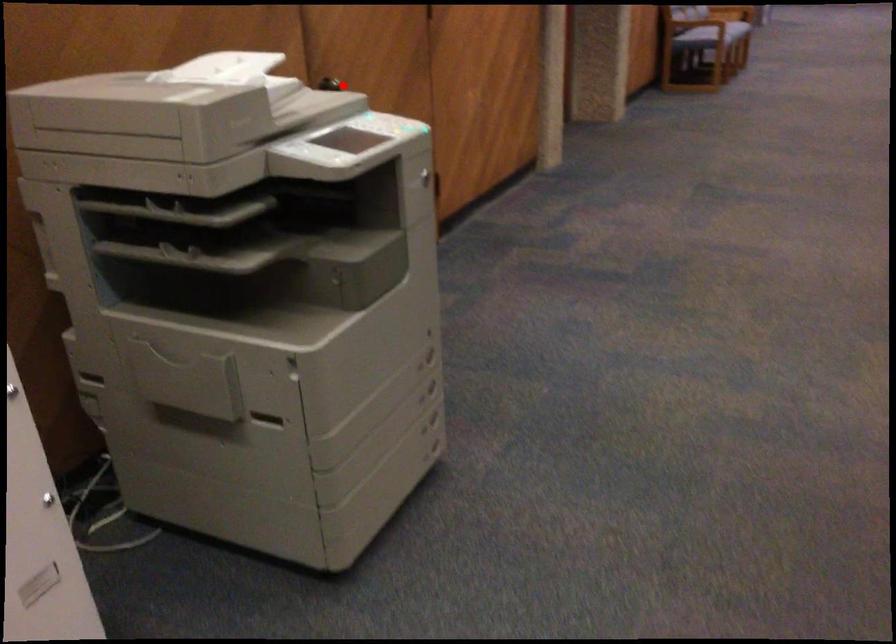
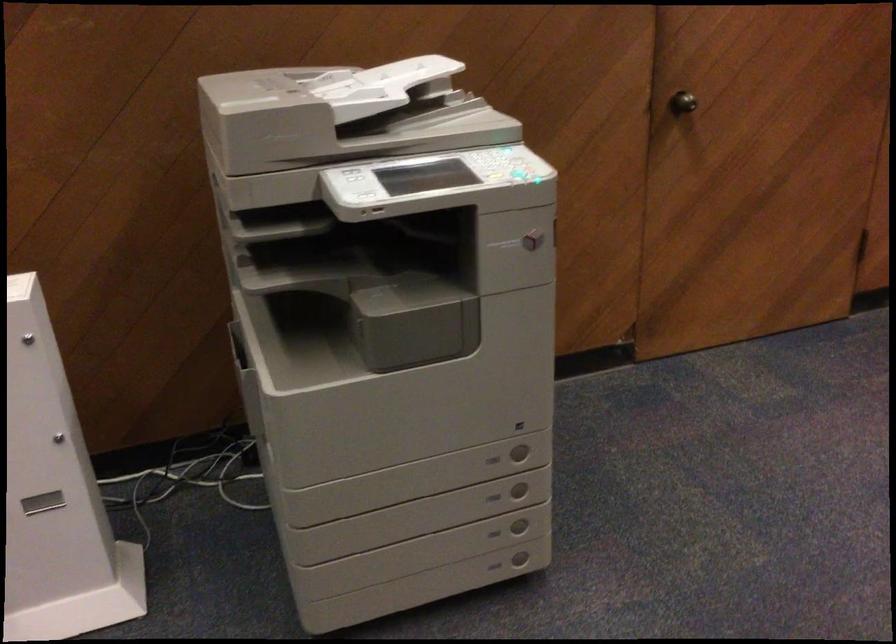
Where in the second image is the point corresponding to the highlighted location from the first image?

(682, 102)